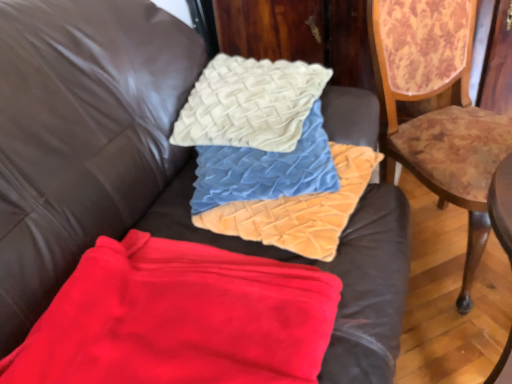
Question: From the image's perspective, does velvet textured pillow at center appear higher than wooden floral-patterned chair at right?

Choices:
 (A) no
 (B) yes

Answer: (A)

Question: Can you confirm if velvet textured pillow at center is smaller than wooden floral-patterned chair at right?

Choices:
 (A) yes
 (B) no

Answer: (A)

Question: From a real-world perspective, does velvet textured pillow at center sit lower than wooden floral-patterned chair at right?

Choices:
 (A) yes
 (B) no

Answer: (B)

Question: Is wooden floral-patterned chair at right completely or partially inside velvet textured pillow at center?

Choices:
 (A) yes
 (B) no

Answer: (B)

Question: Is velvet textured pillow at center thinner than wooden floral-patterned chair at right?

Choices:
 (A) yes
 (B) no

Answer: (A)

Question: Choose the correct answer: Is velvet textured pillows at center, which is the 1th material in top-to-bottom order, inside red fleece blanket at lower left, which appears as the 1th material when ordered from the bottom, or outside it?

Choices:
 (A) inside
 (B) outside

Answer: (B)

Question: From a real-world perspective, is velvet textured pillows at center, which is the 1th material in top-to-bottom order, above or below red fleece blanket at lower left, the second material when ordered from top to bottom?

Choices:
 (A) above
 (B) below

Answer: (A)

Question: Considering the positions of point (x=314, y=200) and point (x=58, y=294), is point (x=314, y=200) closer or farther from the camera than point (x=58, y=294)?

Choices:
 (A) farther
 (B) closer

Answer: (A)

Question: In the image, is velvet textured pillows at center, the second material positioned from the bottom, positioned in front of or behind red fleece blanket at lower left, the second material when ordered from top to bottom?

Choices:
 (A) front
 (B) behind

Answer: (B)

Question: In the image, is red fleece blanket at lower left, which appears as the 1th material when ordered from the bottom, on the left side or the right side of creamy velvet cushion at upper center?

Choices:
 (A) right
 (B) left

Answer: (B)

Question: From the image's perspective, is red fleece blanket at lower left, the second material when ordered from top to bottom, positioned above or below creamy velvet cushion at upper center?

Choices:
 (A) above
 (B) below

Answer: (B)

Question: Looking at the image, does red fleece blanket at lower left, the second material when ordered from top to bottom, seem bigger or smaller compared to creamy velvet cushion at upper center?

Choices:
 (A) small
 (B) big

Answer: (A)

Question: In the image, is red fleece blanket at lower left, the second material when ordered from top to bottom, positioned in front of or behind creamy velvet cushion at upper center?

Choices:
 (A) front
 (B) behind

Answer: (A)

Question: Would you say creamy velvet cushion at upper center is to the left or to the right of velvet textured pillow at center in the picture?

Choices:
 (A) right
 (B) left

Answer: (B)

Question: From a real-world perspective, relative to velvet textured pillow at center, is creamy velvet cushion at upper center vertically above or below?

Choices:
 (A) below
 (B) above

Answer: (B)